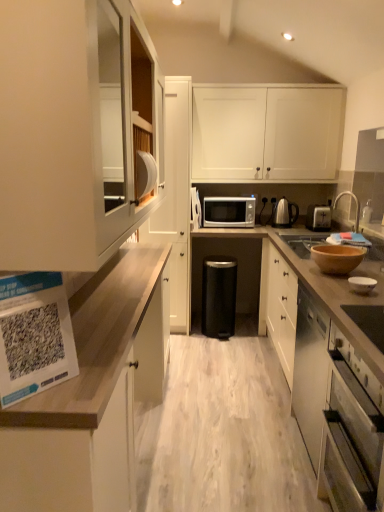
Question: Is silver metallic faucet at upper right beside wooden countertop at left, positioned as the second cabinetry in left-to-right order?

Choices:
 (A) no
 (B) yes

Answer: (A)

Question: Can you confirm if silver metallic faucet at upper right is positioned to the right of wooden countertop at left, positioned as the second cabinetry in left-to-right order?

Choices:
 (A) yes
 (B) no

Answer: (A)

Question: Is silver metallic faucet at upper right not within wooden countertop at left, positioned as the 3th cabinetry in right-to-left order?

Choices:
 (A) yes
 (B) no

Answer: (A)

Question: From the image's perspective, does silver metallic faucet at upper right appear lower than wooden countertop at left, positioned as the 3th cabinetry in right-to-left order?

Choices:
 (A) no
 (B) yes

Answer: (A)

Question: From the image's perspective, would you say silver metallic faucet at upper right is positioned over wooden countertop at left, positioned as the second cabinetry in left-to-right order?

Choices:
 (A) yes
 (B) no

Answer: (A)

Question: Is silver metallic faucet at upper right oriented away from wooden countertop at left, positioned as the 3th cabinetry in right-to-left order?

Choices:
 (A) no
 (B) yes

Answer: (A)

Question: Is silver metallic microwave at center inside stainless steel oven at lower right?

Choices:
 (A) no
 (B) yes

Answer: (A)

Question: From a real-world perspective, is stainless steel oven at lower right over silver metallic microwave at center?

Choices:
 (A) yes
 (B) no

Answer: (B)

Question: Could you tell me if stainless steel oven at lower right is turned towards silver metallic microwave at center?

Choices:
 (A) yes
 (B) no

Answer: (B)

Question: Is stainless steel oven at lower right at the right side of silver metallic microwave at center?

Choices:
 (A) yes
 (B) no

Answer: (A)

Question: Can you confirm if stainless steel oven at lower right is wider than silver metallic microwave at center?

Choices:
 (A) yes
 (B) no

Answer: (B)

Question: From the image's perspective, would you say stainless steel oven at lower right is shown under silver metallic microwave at center?

Choices:
 (A) yes
 (B) no

Answer: (A)

Question: Is white matte cabinet at upper center, the fourth cabinetry in the left-to-right sequence, touching silver metallic toaster at right?

Choices:
 (A) no
 (B) yes

Answer: (A)